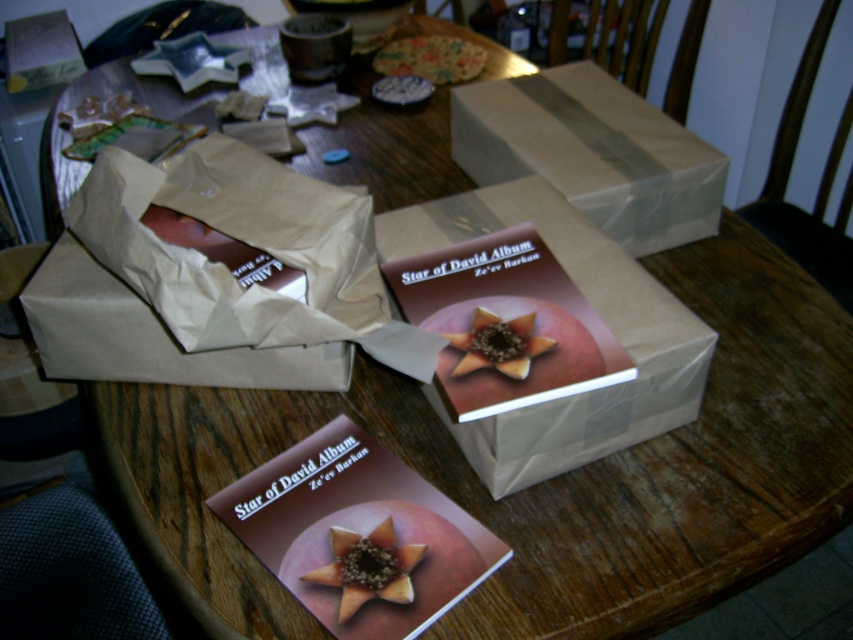
Question: Which object is positioned farthest from the brown paper bag at center?

Choices:
 (A) matte brown book at center
 (B) white paper box at upper center
 (C) matte brown star at center

Answer: (B)

Question: Is white paper box at upper center to the right of matte brown flower at center from the viewer's perspective?

Choices:
 (A) no
 (B) yes

Answer: (B)

Question: Is the position of matte brown star at center less distant than that of crumbly cookie at center?

Choices:
 (A) yes
 (B) no

Answer: (A)

Question: Which object appears closest to the camera in this image?

Choices:
 (A) white paper box at upper center
 (B) crumbly cookie at center
 (C) brown paper bag at center
 (D) matte brown star at center

Answer: (D)

Question: Is white paper box at upper center further to the viewer compared to matte brown flower at center?

Choices:
 (A) yes
 (B) no

Answer: (A)

Question: Which of these objects is positioned closest to the matte brown star at center?

Choices:
 (A) crumbly cookie at center
 (B) matte brown book at center
 (C) brown paper bag at center
 (D) white paper box at upper center

Answer: (B)